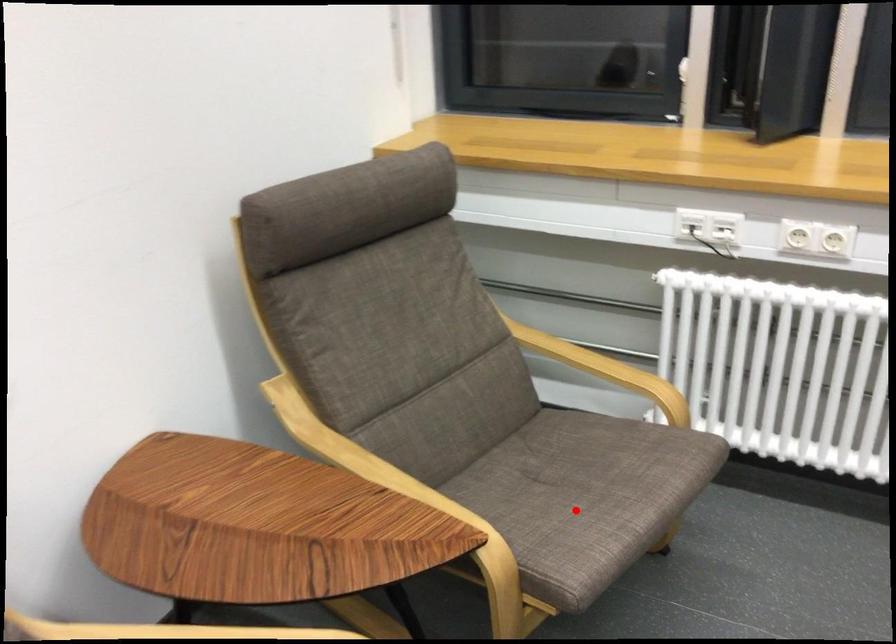
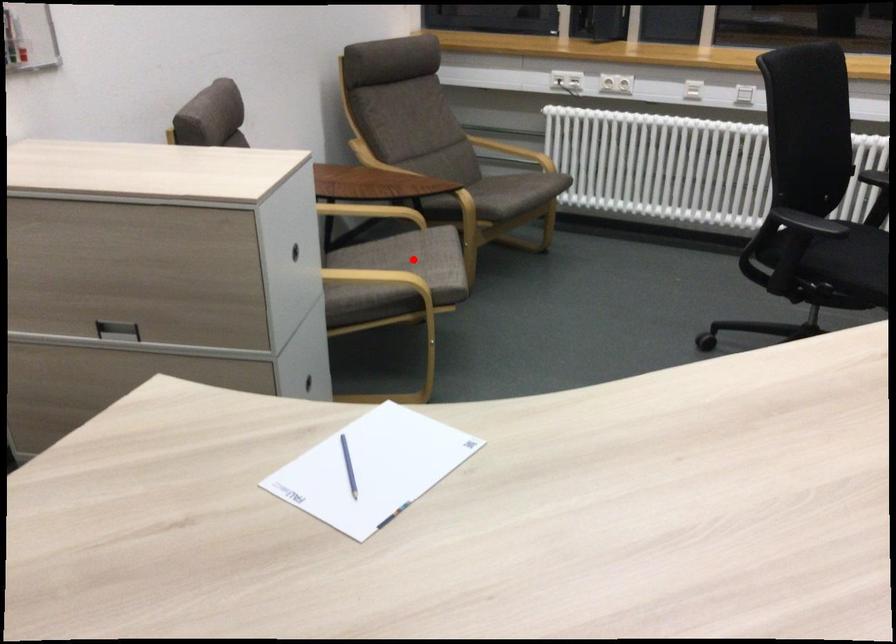
I am providing you with two images of the same scene from different viewpoints. A red point is marked on the first image and another point is marked on the second image. Does the point marked in image1 correspond to the same location as the one in image2?

No